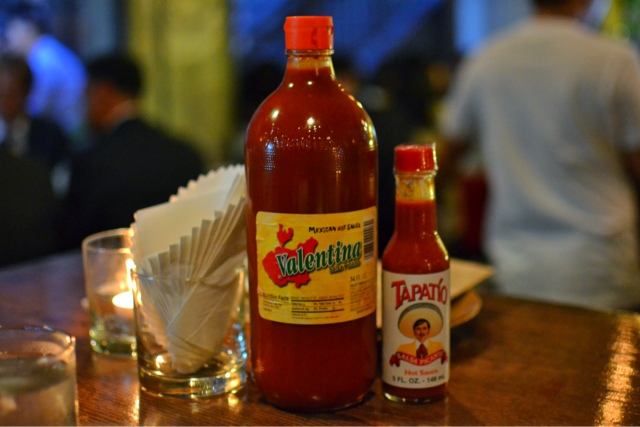
Identify the location of small glasses. (146, 342), (105, 300), (41, 396).